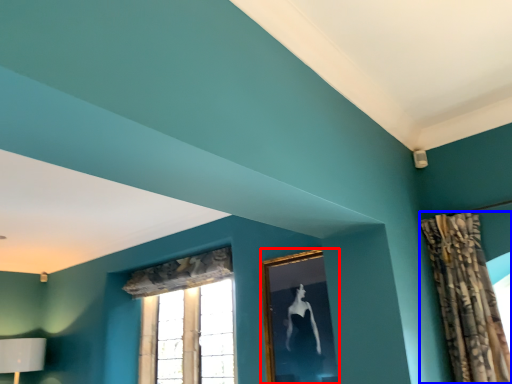
Question: Among these objects, which one is nearest to the camera, picture frame (highlighted by a red box) or curtain (highlighted by a blue box)?

Choices:
 (A) picture frame
 (B) curtain

Answer: (B)